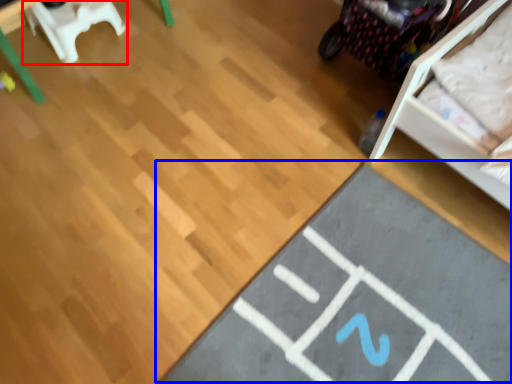
Question: Which object is closer to the camera taking this photo, furniture (highlighted by a red box) or yoga mat (highlighted by a blue box)?

Choices:
 (A) furniture
 (B) yoga mat

Answer: (B)